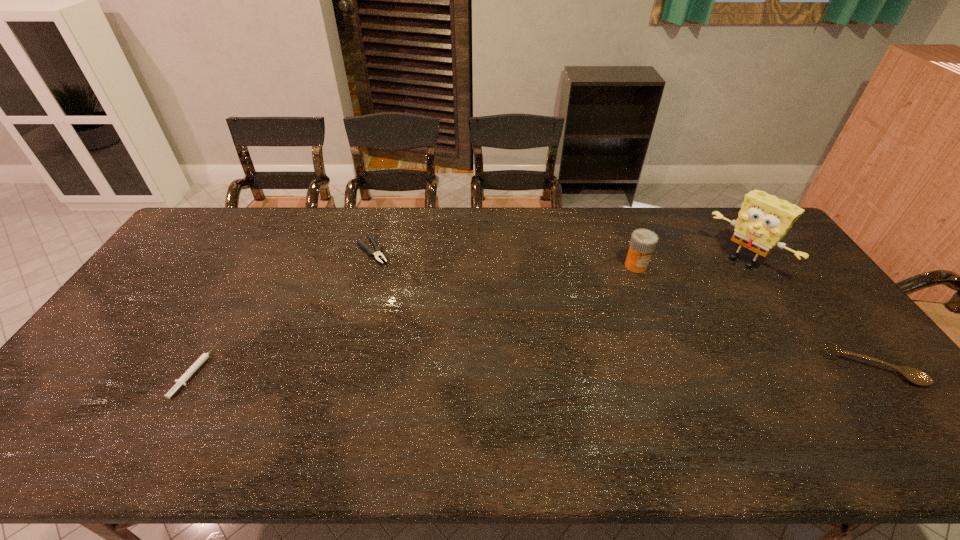
Find the location of `free spot on the desktop that is between the leftmost object and the ladle and is positioned on the face of the tallest object`. free spot on the desktop that is between the leftmost object and the ladle and is positioned on the face of the tallest object is located at coordinates (613, 369).

This screenshot has width=960, height=540. In order to click on vacant space on the desktop that is between the syringe and the third tallest object and is positioned on the label side of the third object from left to right in this screenshot , I will do `click(627, 369)`.

Locate an element on the screen. This screenshot has width=960, height=540. free space on the desktop that is between the leftmost object and the ladle and is positioned at the gripping part of the fourth object from right to left is located at coordinates (471, 369).